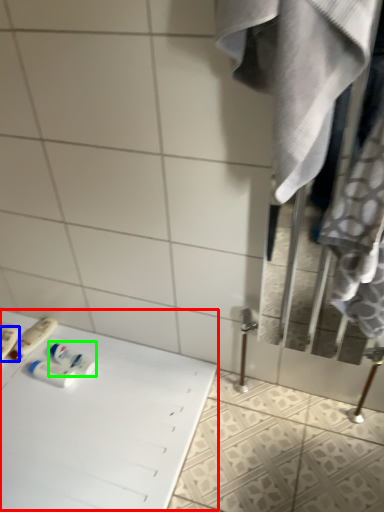
Question: Based on their relative distances, which object is farther from table (highlighted by a red box)? Choose from toiletry (highlighted by a blue box) and mouthwash (highlighted by a green box).

Choices:
 (A) toiletry
 (B) mouthwash

Answer: (A)